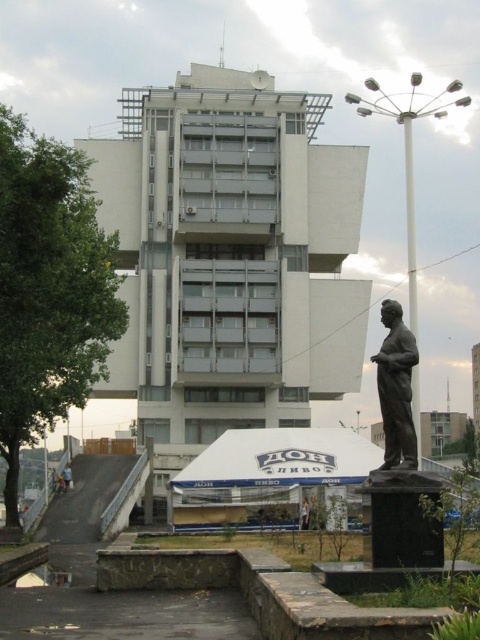
Question: Which object is positioned closest to the metallic helmet at lower left?

Choices:
 (A) bronze statue at right
 (B) light brown wooden bench at lower center

Answer: (B)

Question: Is bronze statue at right below light brown wooden bench at lower center?

Choices:
 (A) yes
 (B) no

Answer: (B)

Question: Does bronze statue at right appear on the left side of metallic helmet at lower left?

Choices:
 (A) no
 (B) yes

Answer: (A)

Question: Which point appears closest to the camera in this image?

Choices:
 (A) (66, 484)
 (B) (380, 468)

Answer: (B)

Question: Which point is closer to the camera?

Choices:
 (A) (409, 387)
 (B) (70, 477)

Answer: (A)

Question: Does light brown wooden bench at lower center appear under metallic helmet at lower left?

Choices:
 (A) no
 (B) yes

Answer: (A)